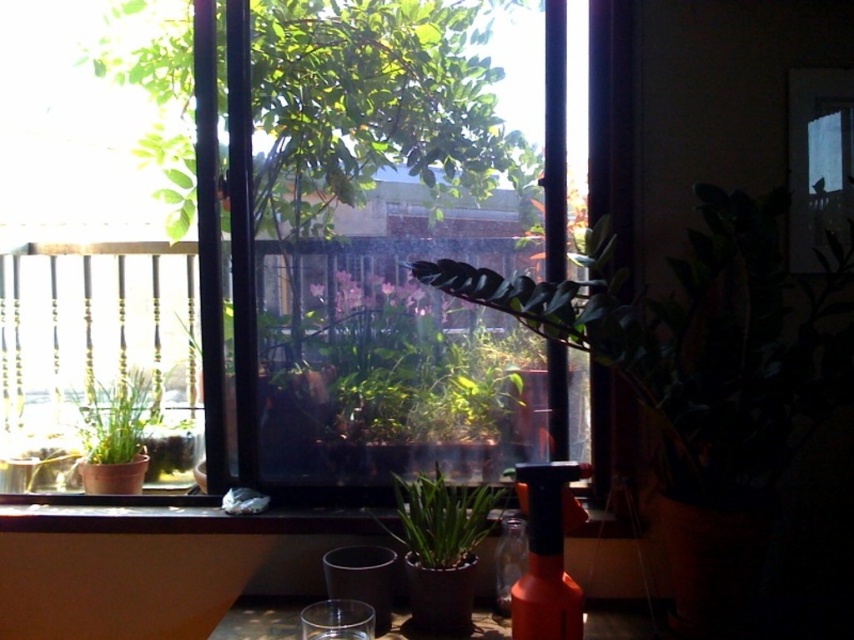
Question: Does transparent glass window at center lie behind green matte plant at left?

Choices:
 (A) no
 (B) yes

Answer: (A)

Question: Which point appears farthest from the camera in this image?

Choices:
 (A) (551, 552)
 (B) (509, 584)
 (C) (613, 362)

Answer: (B)

Question: Which object appears farthest from the camera in this image?

Choices:
 (A) translucent glass bottle at center
 (B) transparent glass table at lower center
 (C) green matte leafy plant at center

Answer: (A)

Question: Can you confirm if green matte leafy plant at center is positioned above orange matte spray bottle at lower right?

Choices:
 (A) yes
 (B) no

Answer: (A)

Question: Can you confirm if orange matte spray bottle at lower right is smaller than green matte plant at center?

Choices:
 (A) no
 (B) yes

Answer: (B)

Question: Among these objects, which one is nearest to the camera?

Choices:
 (A) orange matte spray bottle at lower right
 (B) transparent glass table at lower center

Answer: (A)